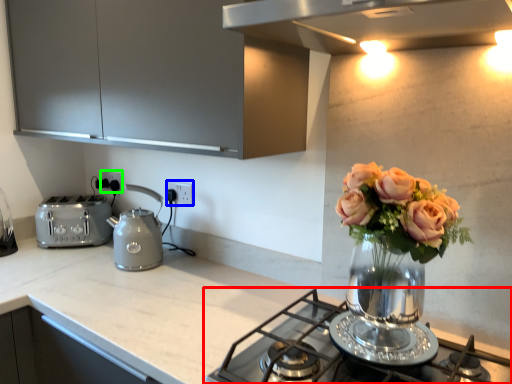
Question: Which object is positioned closest to gas stove (highlighted by a red box)? Select from electric outlet (highlighted by a blue box) and electric outlet (highlighted by a green box).

Choices:
 (A) electric outlet
 (B) electric outlet

Answer: (A)